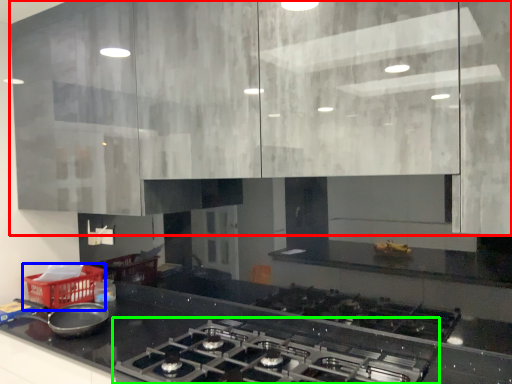
Question: Estimate the real-world distances between objects in this image. Which object is farther from cabinetry (highlighted by a red box), basket (highlighted by a blue box) or gas stove (highlighted by a green box)?

Choices:
 (A) basket
 (B) gas stove

Answer: (A)